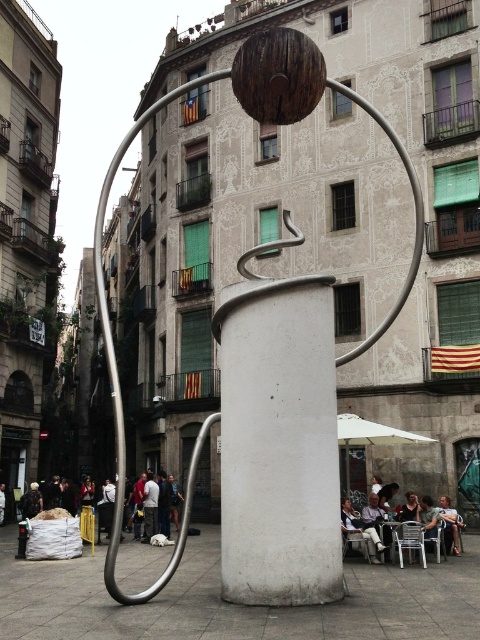
Question: Based on their relative distances, which object is nearer to the white fabric chair at lower right?

Choices:
 (A) dark gray jacket at lower left
 (B) white matte pillar at center
 (C) light brown leather jacket at lower right

Answer: (C)

Question: Does matte white chair at lower center have a larger size compared to white fabric chair at lower right?

Choices:
 (A) no
 (B) yes

Answer: (B)

Question: Which object is closer to the camera taking this photo?

Choices:
 (A) matte white chair at lower center
 (B) white matte pillar at center

Answer: (B)

Question: Does white matte pillar at center have a greater width compared to white fabric chair at lower right?

Choices:
 (A) no
 (B) yes

Answer: (B)

Question: Does matte white chair at lower center have a lesser width compared to dark gray jacket at lower left?

Choices:
 (A) yes
 (B) no

Answer: (B)

Question: Which point is farther to the camera?

Choices:
 (A) white matte pillar at center
 (B) light brown leather jacket at lower right
 (C) matte white chair at lower center

Answer: (B)